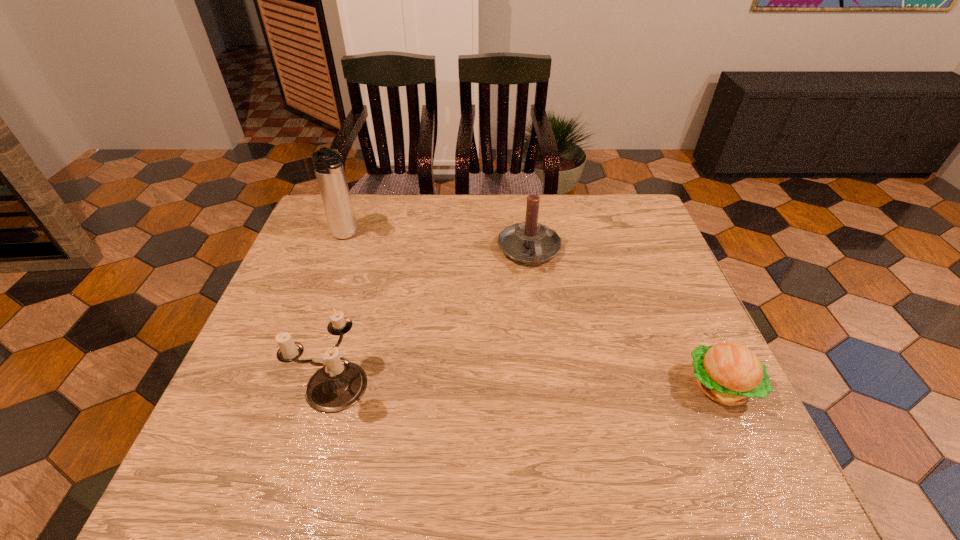
This screenshot has width=960, height=540. I want to click on candle holder, so click(339, 384).

Find the location of a particular element. hamburger is located at coordinates (729, 373).

Locate an element on the screen. This screenshot has width=960, height=540. the shortest object is located at coordinates (729, 373).

Identify the location of thermos bottle. (328, 166).

I want to click on the second object from right to left, so click(529, 242).

The image size is (960, 540). I want to click on vacant point located on the right of the candle holder, so click(x=534, y=384).

I want to click on vacant space located 0.220m on the left of the hamburger, so click(x=582, y=386).

Where is `vacant space situated 0.390m on the handle side of the tallest object`? The image size is (960, 540). vacant space situated 0.390m on the handle side of the tallest object is located at coordinates (420, 326).

You are a GUI agent. You are given a task and a screenshot of the screen. Output one action in this format:
    pyautogui.click(x=<x>, y=<y>)
    Task: Click on the free location located on the handle side of the tallest object
    The width and height of the screenshot is (960, 540).
    Given the screenshot: What is the action you would take?
    pyautogui.click(x=376, y=272)

Where is `free region located on the handle side of the tallest object`? Image resolution: width=960 pixels, height=540 pixels. free region located on the handle side of the tallest object is located at coordinates point(409,311).